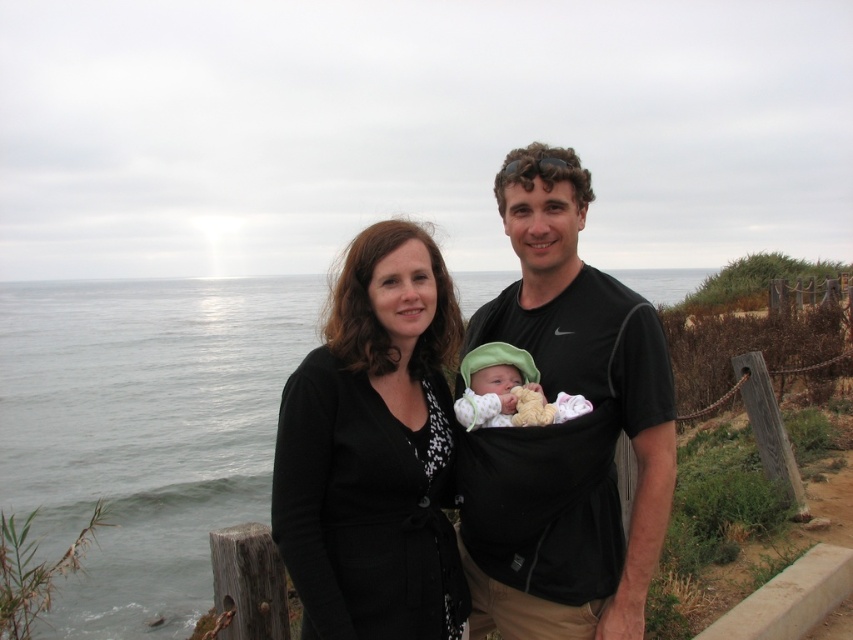
Can you confirm if black fabric baby carrier at center is smaller than soft green knit hat at center?

Actually, black fabric baby carrier at center might be larger than soft green knit hat at center.

Locate an element on the screen. The height and width of the screenshot is (640, 853). black fabric baby carrier at center is located at coordinates (566, 429).

Is black matte/black textured cardigan at center to the right of soft green knit hat at center from the viewer's perspective?

Incorrect, black matte/black textured cardigan at center is not on the right side of soft green knit hat at center.

Can you confirm if black matte/black textured cardigan at center is thinner than soft green knit hat at center?

No.

I want to click on black matte/black textured cardigan at center, so click(373, 449).

Locate an element on the screen. The image size is (853, 640). black matte/black textured cardigan at center is located at coordinates (373, 449).

Is black fabric baby carrier at center closer to the viewer compared to black matte/black textured cardigan at center?

No, it is behind black matte/black textured cardigan at center.

Does point (598, 420) come behind point (437, 268)?

No, it is in front of (437, 268).

Which is behind, point (549, 433) or point (358, 400)?

Point (549, 433)

Image resolution: width=853 pixels, height=640 pixels. I want to click on black fabric baby carrier at center, so click(x=566, y=429).